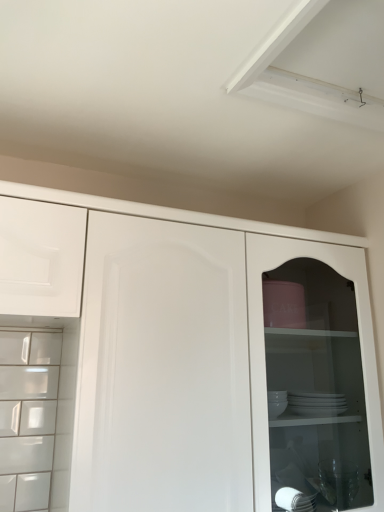
Question: Is white glossy cupboard at center wider or thinner than white matte drawer at upper left?

Choices:
 (A) wide
 (B) thin

Answer: (A)

Question: Is white glossy cupboard at center to the left or to the right of white matte drawer at upper left in the image?

Choices:
 (A) left
 (B) right

Answer: (B)

Question: Would you say white glossy cupboard at center is inside or outside white matte drawer at upper left?

Choices:
 (A) outside
 (B) inside

Answer: (A)

Question: From the image's perspective, is white matte drawer at upper left positioned above or below white glossy cupboard at center?

Choices:
 (A) above
 (B) below

Answer: (A)

Question: Is white matte drawer at upper left to the left or to the right of white glossy cupboard at center in the image?

Choices:
 (A) right
 (B) left

Answer: (B)

Question: Looking at their shapes, would you say white matte drawer at upper left is wider or thinner than white glossy cupboard at center?

Choices:
 (A) wide
 (B) thin

Answer: (B)

Question: Based on their sizes in the image, would you say white matte drawer at upper left is bigger or smaller than white glossy cupboard at center?

Choices:
 (A) small
 (B) big

Answer: (A)